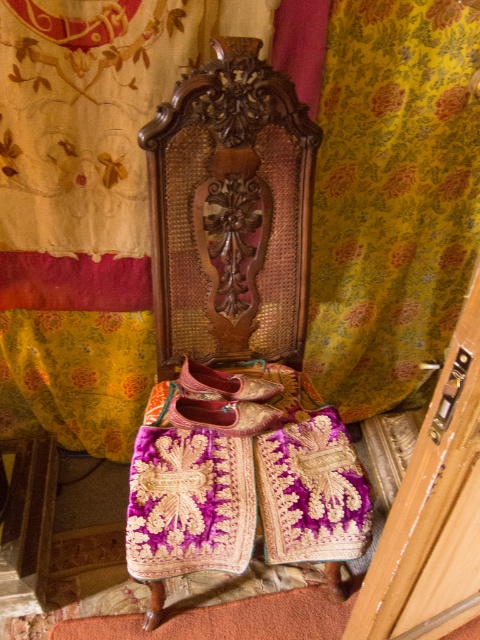
You are arranging a traditional Indian display and need to place the yellow floral fabric at upper center and the dark wood carved headboard at center. According to the scene, which object is positioned to the left of the other?

The yellow floral fabric at upper center is to the left of the dark wood carved headboard at center.